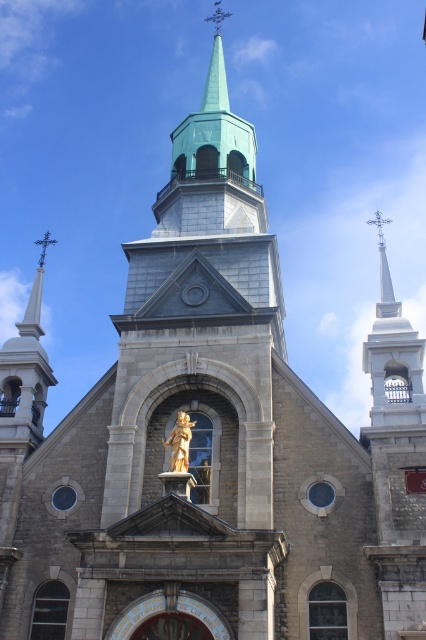
Question: Which object appears farthest from the camera in this image?

Choices:
 (A) polished silver spire at upper right
 (B) gold polished statue at center

Answer: (A)

Question: Can you confirm if white stone steeple at upper right is thinner than polished silver spire at upper right?

Choices:
 (A) yes
 (B) no

Answer: (B)

Question: Among these objects, which one is nearest to the camera?

Choices:
 (A) gold polished statue at center
 (B) polished silver spire at upper right
 (C) white stone steeple at upper right

Answer: (A)

Question: Can you confirm if polished silver spire at upper right is bigger than gold polished statue at center?

Choices:
 (A) no
 (B) yes

Answer: (B)

Question: Which point is farther to the camera?

Choices:
 (A) polished silver spire at upper right
 (B) gold polished statue at center
 (C) white stone steeple at upper right

Answer: (A)

Question: Is polished silver spire at upper right to the right of gold polished statue at center from the viewer's perspective?

Choices:
 (A) no
 (B) yes

Answer: (B)